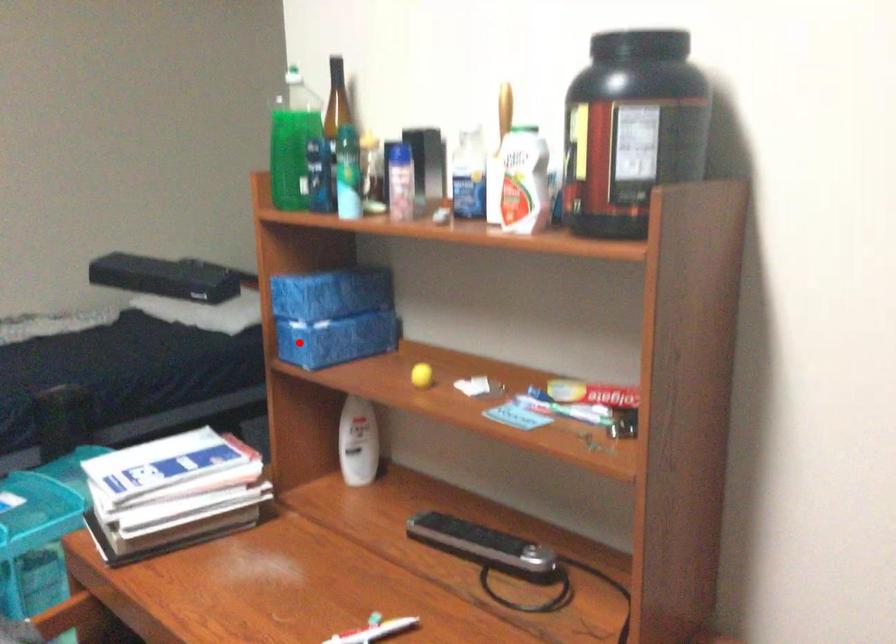
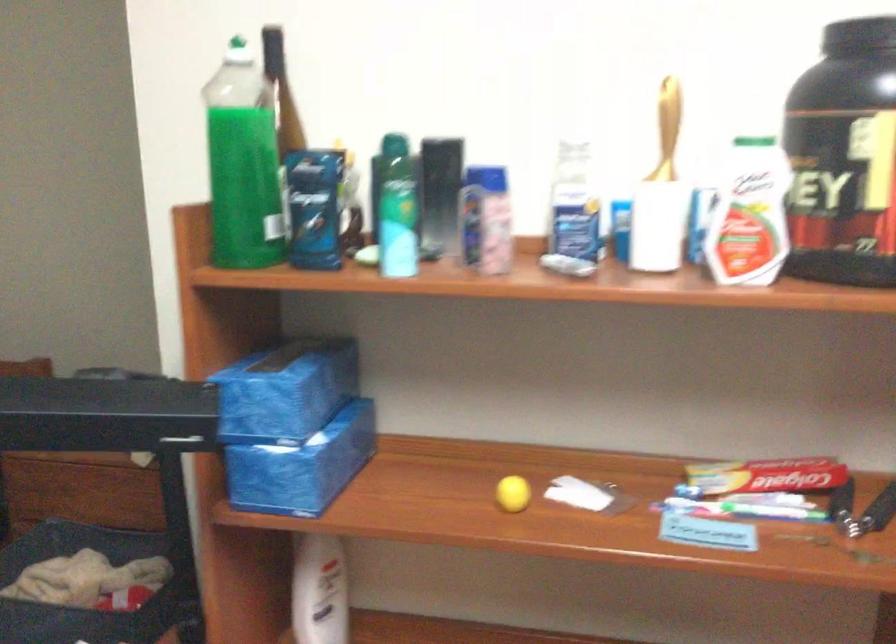
Where in the second image is the point corresponding to the highlighted location from the first image?

(288, 478)